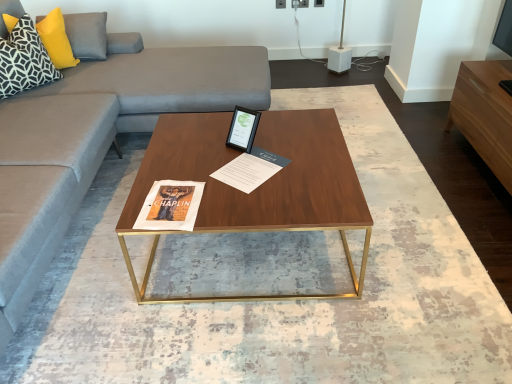
Question: From a real-world perspective, does wooden polished coffee table at center sit lower than black and white geometric fabric pillow at upper left, the second pillow from the back?

Choices:
 (A) no
 (B) yes

Answer: (B)

Question: Could you tell me if wooden polished coffee table at center is turned towards black and white geometric fabric pillow at upper left, the 1th pillow when ordered from front to back?

Choices:
 (A) no
 (B) yes

Answer: (A)

Question: Is wooden polished coffee table at center smaller than black and white geometric fabric pillow at upper left, the 1th pillow when ordered from front to back?

Choices:
 (A) yes
 (B) no

Answer: (B)

Question: Is wooden polished coffee table at center further to the viewer compared to black and white geometric fabric pillow at upper left, the second pillow from the back?

Choices:
 (A) no
 (B) yes

Answer: (A)

Question: Does wooden polished coffee table at center have a greater height compared to black and white geometric fabric pillow at upper left, the 1th pillow when ordered from front to back?

Choices:
 (A) no
 (B) yes

Answer: (B)

Question: From the image's perspective, is wooden polished coffee table at center located above or below light brown wood entertainment center at right?

Choices:
 (A) below
 (B) above

Answer: (A)

Question: Is point (331, 218) closer or farther from the camera than point (454, 102)?

Choices:
 (A) closer
 (B) farther

Answer: (A)

Question: In the image, is wooden polished coffee table at center on the left side or the right side of light brown wood entertainment center at right?

Choices:
 (A) right
 (B) left

Answer: (B)

Question: Looking at their shapes, would you say wooden polished coffee table at center is wider or thinner than light brown wood entertainment center at right?

Choices:
 (A) wide
 (B) thin

Answer: (A)

Question: Is black and white geometric fabric pillow at upper left, the 1th pillow when ordered from front to back, in front of or behind light brown wood entertainment center at right in the image?

Choices:
 (A) front
 (B) behind

Answer: (B)

Question: Considering the positions of point click(12, 36) and point click(459, 96), is point click(12, 36) closer or farther from the camera than point click(459, 96)?

Choices:
 (A) farther
 (B) closer

Answer: (B)

Question: From a real-world perspective, is black and white geometric fabric pillow at upper left, the 1th pillow when ordered from front to back, positioned above or below light brown wood entertainment center at right?

Choices:
 (A) above
 (B) below

Answer: (A)

Question: In terms of width, does black and white geometric fabric pillow at upper left, the 1th pillow when ordered from front to back, look wider or thinner when compared to light brown wood entertainment center at right?

Choices:
 (A) wide
 (B) thin

Answer: (B)

Question: Considering the positions of light brown wood entertainment center at right and matte paper magazine at center in the image, is light brown wood entertainment center at right bigger or smaller than matte paper magazine at center?

Choices:
 (A) small
 (B) big

Answer: (B)

Question: From the image's perspective, is light brown wood entertainment center at right located above or below matte paper magazine at center?

Choices:
 (A) below
 (B) above

Answer: (B)